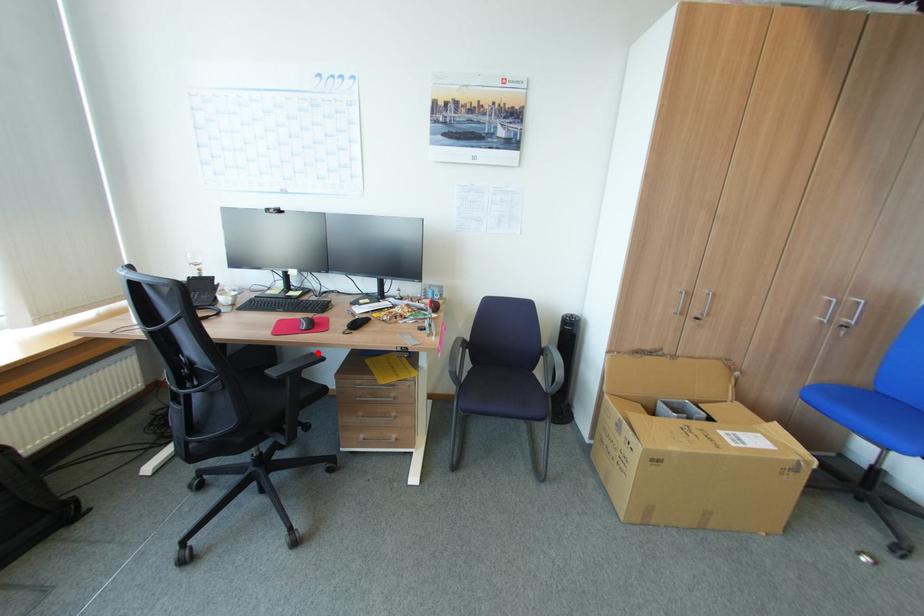
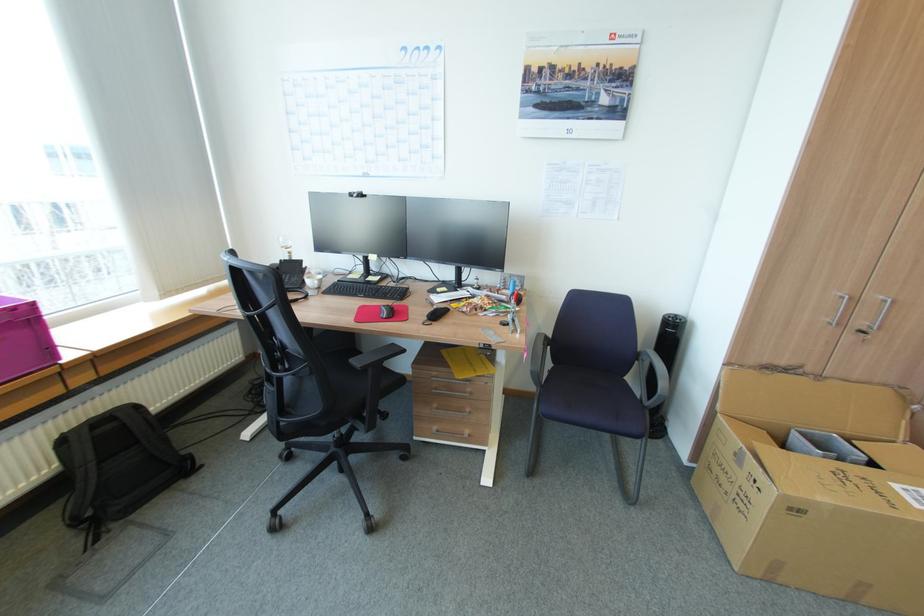
In the second image, find the point that corresponds to the highlighted location in the first image.

(397, 342)